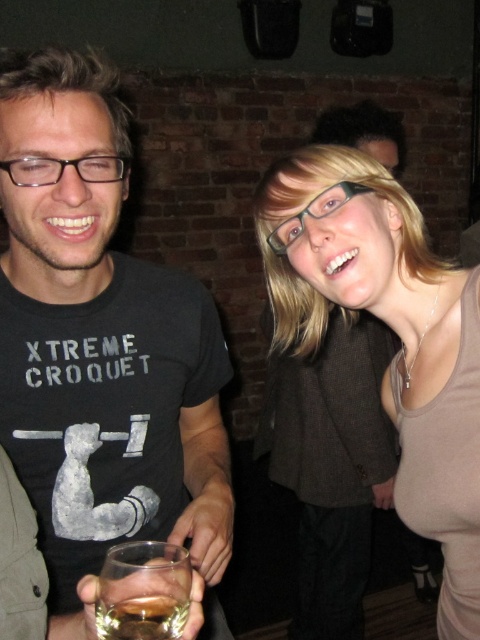
Who is positioned more to the left, gray cotton t-shirt at center or clear glass at lower center?

gray cotton t-shirt at center

Is point (66, 77) closer to viewer compared to point (151, 596)?

No.

This screenshot has height=640, width=480. What are the coordinates of `gray cotton t-shirt at center` in the screenshot? It's located at [x=99, y=340].

Is gray cotton t-shirt at center bigger than matte brown tank top at center?

No.

Who is taller, gray cotton t-shirt at center or matte brown tank top at center?

With more height is gray cotton t-shirt at center.

Which is in front, point (84, 413) or point (428, 467)?

Point (428, 467) is in front.

Image resolution: width=480 pixels, height=640 pixels. In order to click on gray cotton t-shirt at center in this screenshot , I will do `click(99, 340)`.

Can you confirm if clear glass at lower center is positioned to the left of amber liquid glass at lower left?

Yes, clear glass at lower center is to the left of amber liquid glass at lower left.

Is clear glass at lower center wider than amber liquid glass at lower left?

Yes.

This screenshot has width=480, height=640. What do you see at coordinates (144, 592) in the screenshot?
I see `clear glass at lower center` at bounding box center [144, 592].

You are a GUI agent. You are given a task and a screenshot of the screen. Output one action in this format:
    pyautogui.click(x=<x>, y=<y>)
    Task: Click on the clear glass at lower center
    
    Given the screenshot: What is the action you would take?
    pyautogui.click(x=144, y=592)